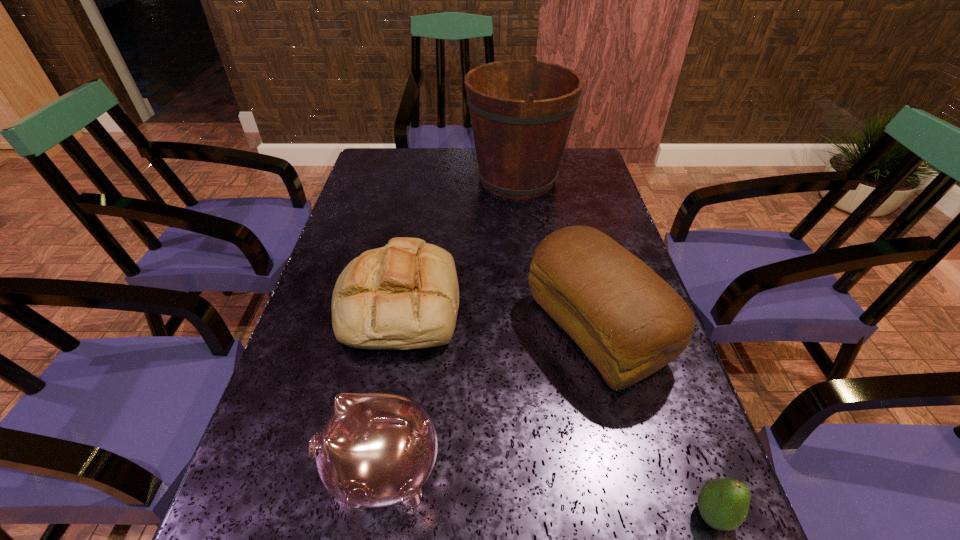
Identify the location of the tallest object. The width and height of the screenshot is (960, 540). tap(521, 111).

This screenshot has height=540, width=960. Find the location of `bucket`. bucket is located at coordinates coord(521,111).

This screenshot has width=960, height=540. Identify the location of the right bread. (630, 323).

Find the location of `the taller bread`. the taller bread is located at coordinates (630, 323).

What are the coordinates of `piggy bank` in the screenshot? It's located at click(377, 449).

The height and width of the screenshot is (540, 960). I want to click on the second shortest object, so click(405, 295).

Image resolution: width=960 pixels, height=540 pixels. In order to click on the left bread in this screenshot , I will do `click(405, 295)`.

The image size is (960, 540). In order to click on avocado in this screenshot , I will do `click(723, 503)`.

Where is `vacant area located 0.060m on the left of the bucket`? This screenshot has width=960, height=540. vacant area located 0.060m on the left of the bucket is located at coordinates (448, 179).

Identify the location of free space located 0.230m on the back of the right bread. This screenshot has height=540, width=960. (568, 221).